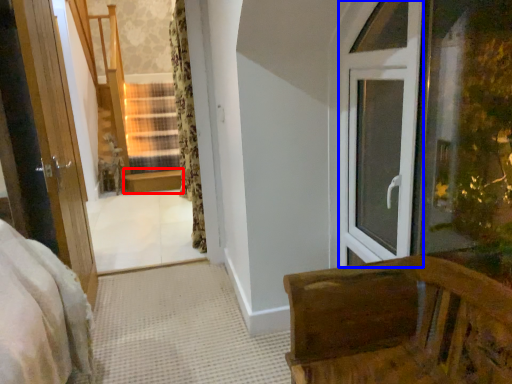
Question: Which object appears farthest to the camera in this image, window sill (highlighted by a red box) or window frame (highlighted by a blue box)?

Choices:
 (A) window sill
 (B) window frame

Answer: (A)